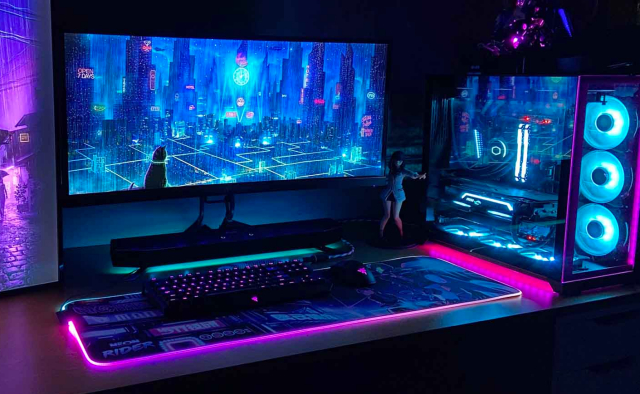
The image size is (640, 394). Find the location of `desk drawers`. desk drawers is located at coordinates (602, 342), (589, 381).